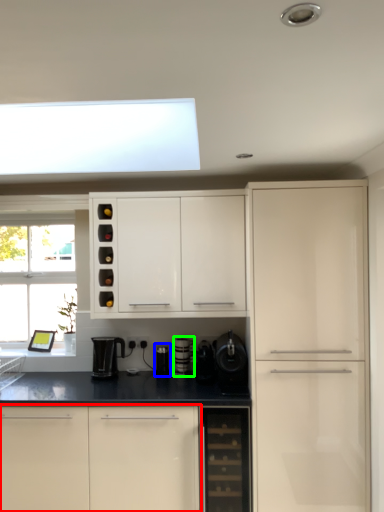
Question: Based on their relative distances, which object is nearer to cabinetry (highlighted by a red box)? Choose from appliance (highlighted by a blue box) and appliance (highlighted by a green box).

Choices:
 (A) appliance
 (B) appliance

Answer: (A)